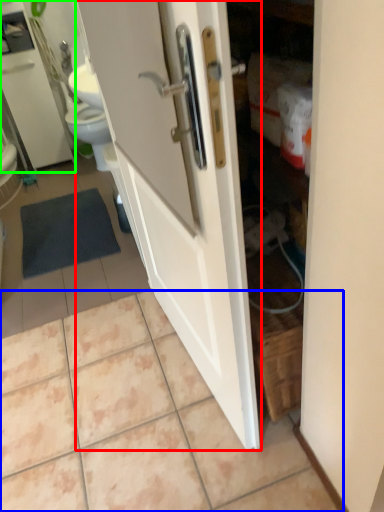
Question: Which is farther away from door (highlighted by a red box)? ceramic tile (highlighted by a blue box) or medicine cabinet (highlighted by a green box)?

Choices:
 (A) ceramic tile
 (B) medicine cabinet

Answer: (B)